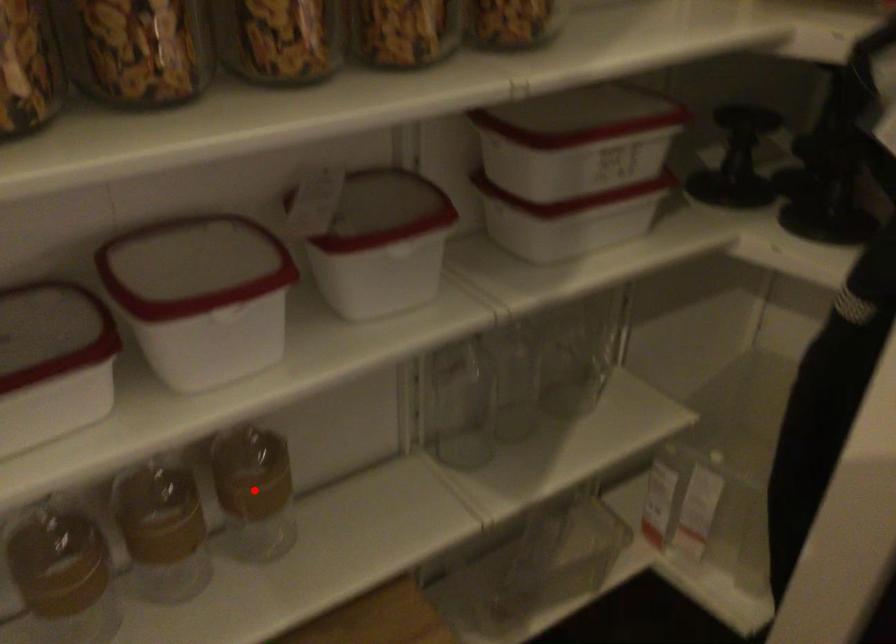
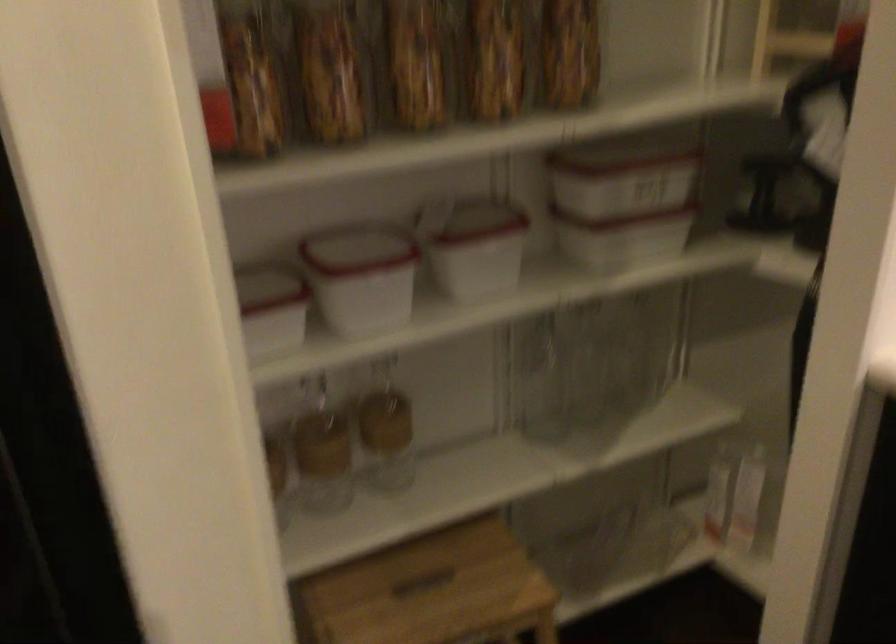
Question: I am providing you with two images of the same scene from different viewpoints. In image1, a red point is highlighted. Considering the same 3D point in image2, which of the following is correct?

Choices:
 (A) It is closer
 (B) It is farther

Answer: (B)